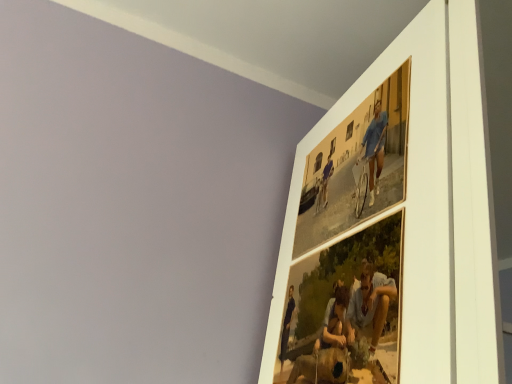
Question: Looking at the image, does matte paper photo frame at upper right, which ranks as the 2th picture frame in bottom-to-top order, seem bigger or smaller compared to matte wooden photo frame at upper right, which is the first picture frame from bottom to top?

Choices:
 (A) small
 (B) big

Answer: (A)

Question: Is matte paper photo frame at upper right, which ranks as the 2th picture frame in bottom-to-top order, inside the boundaries of matte wooden photo frame at upper right, acting as the 2th picture frame starting from the top, or outside?

Choices:
 (A) outside
 (B) inside

Answer: (A)

Question: Considering the positions of point (372, 92) and point (300, 274), is point (372, 92) closer or farther from the camera than point (300, 274)?

Choices:
 (A) farther
 (B) closer

Answer: (B)

Question: Relative to matte paper photo frame at upper right, which ranks as the 2th picture frame in bottom-to-top order, is matte wooden photo frame at upper right, acting as the 2th picture frame starting from the top, in front or behind?

Choices:
 (A) behind
 (B) front

Answer: (B)

Question: Is matte wooden photo frame at upper right, which is the first picture frame from bottom to top, situated inside matte paper photo frame at upper right, which is the 1th picture frame from top to bottom, or outside?

Choices:
 (A) outside
 (B) inside

Answer: (A)

Question: From a real-world perspective, is matte wooden photo frame at upper right, which is the first picture frame from bottom to top, physically located above or below matte paper photo frame at upper right, which is the 1th picture frame from top to bottom?

Choices:
 (A) above
 (B) below

Answer: (B)

Question: From the image's perspective, is matte wooden photo frame at upper right, acting as the 2th picture frame starting from the top, above or below matte paper photo frame at upper right, which is the 1th picture frame from top to bottom?

Choices:
 (A) below
 (B) above

Answer: (A)